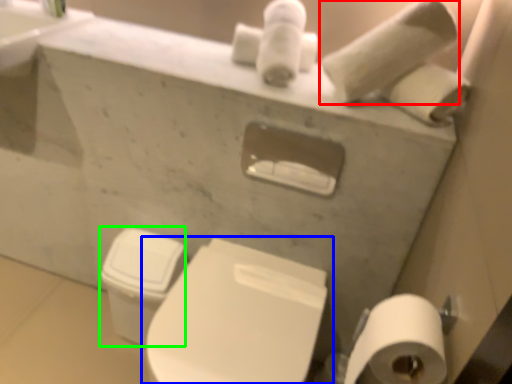
Question: Which object is the farthest from toilet paper (highlighted by a red box)? Choose among these: toilet (highlighted by a blue box) or toilet bowl (highlighted by a green box).

Choices:
 (A) toilet
 (B) toilet bowl

Answer: (B)